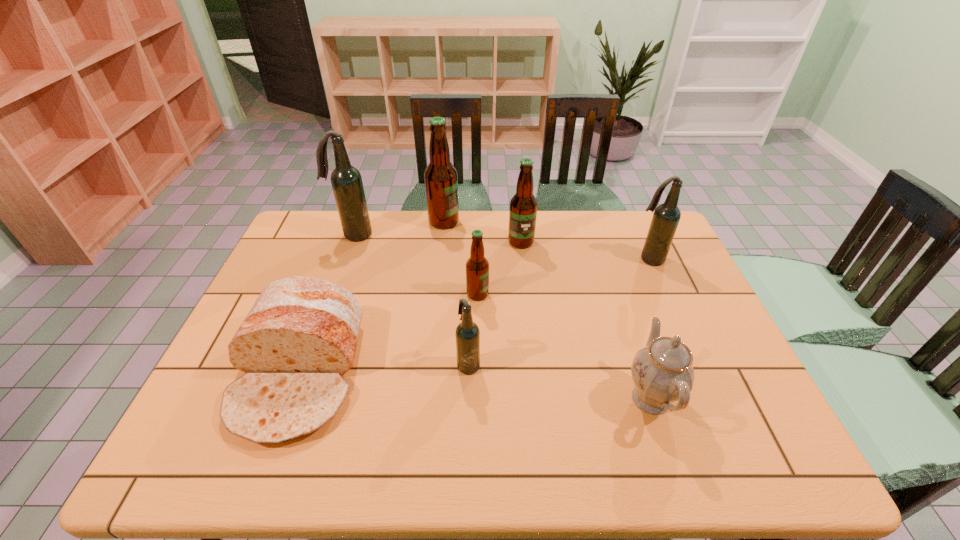
Where is `the second dark beer bottle from left to right`? The image size is (960, 540). the second dark beer bottle from left to right is located at coordinates (467, 333).

The image size is (960, 540). What are the coordinates of `the smallest dark beer bottle` in the screenshot? It's located at (467, 333).

The width and height of the screenshot is (960, 540). Identify the location of chinaware. (662, 372).

Locate an element on the screen. This screenshot has width=960, height=540. the shortest object is located at coordinates (299, 338).

This screenshot has width=960, height=540. Find the location of `vacant space situated 0.120m on the label of the sixth object from right to left`. vacant space situated 0.120m on the label of the sixth object from right to left is located at coordinates (492, 222).

Where is `vacant point located 0.100m on the front of the leftmost beer bottle`? vacant point located 0.100m on the front of the leftmost beer bottle is located at coordinates (344, 262).

The width and height of the screenshot is (960, 540). What are the coordinates of `vacant space located on the left of the second smallest dark beer bottle` in the screenshot? It's located at (526, 259).

Where is `blank area located 0.100m on the label of the second beer bottle from right to left`? blank area located 0.100m on the label of the second beer bottle from right to left is located at coordinates (524, 270).

Find the location of `vacant point located on the label of the nearest brown beer bottle`. vacant point located on the label of the nearest brown beer bottle is located at coordinates (584, 294).

Where is `free location located on the back of the second dark beer bottle from right to left`? This screenshot has height=540, width=960. free location located on the back of the second dark beer bottle from right to left is located at coordinates (469, 334).